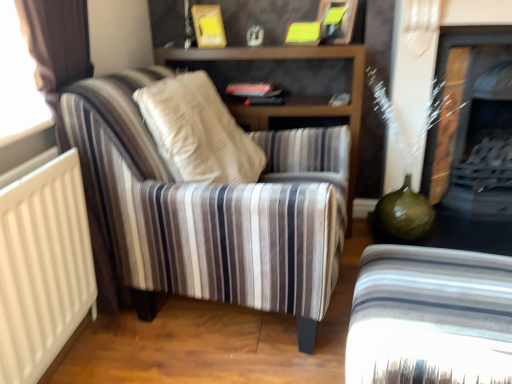
Describe the element at coordinates (211, 209) in the screenshot. I see `striped fabric armchair at left, which is the 2th chair from right to left` at that location.

Identify the location of striped fabric armchair at lower right, which is the 2th chair from left to right. The image size is (512, 384). (430, 317).

At what (x,y) coordinates should I click in order to perform the action: click on matte black fireplace at right. Please return your answer as a coordinate pair (x, y). Looking at the image, I should click on (475, 123).

Is striped fabric armchair at left, which is the 2th chair from right to left, to the left of matte black fireplace at right from the viewer's perspective?

Indeed, striped fabric armchair at left, which is the 2th chair from right to left, is positioned on the left side of matte black fireplace at right.

From the image's perspective, which one is positioned higher, striped fabric armchair at left, which is the 2th chair from right to left, or matte black fireplace at right?

matte black fireplace at right.

Which is correct: striped fabric armchair at left, which is the 2th chair from right to left, is inside matte black fireplace at right, or outside of it?

striped fabric armchair at left, which is the 2th chair from right to left, cannot be found inside matte black fireplace at right.

Can you confirm if matte black fireplace at right is thinner than striped fabric armchair at left, which ranks as the 1th chair in left-to-right order?

Yes.

From the picture: Does matte black fireplace at right lie behind striped fabric armchair at left, which ranks as the 1th chair in left-to-right order?

Yes, it is.

Is matte black fireplace at right inside or outside of striped fabric armchair at left, which is the 2th chair from right to left?

matte black fireplace at right cannot be found inside striped fabric armchair at left, which is the 2th chair from right to left.

How many degrees apart are the facing directions of matte black fireplace at right and striped fabric armchair at left, which is the 2th chair from right to left?

They differ by 80.3 degrees in their facing directions.

From a real-world perspective, which is physically below, matte black fireplace at right or striped fabric armchair at lower right, the 1th chair from the right?

striped fabric armchair at lower right, the 1th chair from the right, is physically lower.

You are a GUI agent. You are given a task and a screenshot of the screen. Output one action in this format:
    pyautogui.click(x=<x>, y=<y>)
    Task: Click on the chair that is the 2nd one when counting downward from the matte black fireplace at right (from the image's perspective)
    The image size is (512, 384).
    Given the screenshot: What is the action you would take?
    pyautogui.click(x=430, y=317)

Considering the points (490, 38) and (395, 284), which point is in front, point (490, 38) or point (395, 284)?

Point (395, 284)

Which object is further away from the camera, matte black fireplace at right or striped fabric armchair at lower right, the 1th chair from the right?

matte black fireplace at right is further from the camera.

Consider the image. Considering the sizes of objects striped fabric armchair at left, which is the 2th chair from right to left, and striped fabric armchair at lower right, the 1th chair from the right, in the image provided, who is shorter, striped fabric armchair at left, which is the 2th chair from right to left, or striped fabric armchair at lower right, the 1th chair from the right,?

striped fabric armchair at lower right, the 1th chair from the right, is shorter.

Are striped fabric armchair at left, which ranks as the 1th chair in left-to-right order, and striped fabric armchair at lower right, which is the 2th chair from left to right, beside each other?

No, striped fabric armchair at left, which ranks as the 1th chair in left-to-right order, is not with striped fabric armchair at lower right, which is the 2th chair from left to right.

From a real-world perspective, is striped fabric armchair at left, which ranks as the 1th chair in left-to-right order, under striped fabric armchair at lower right, which is the 2th chair from left to right?

No, from a real-world perspective, striped fabric armchair at left, which ranks as the 1th chair in left-to-right order, is not beneath striped fabric armchair at lower right, which is the 2th chair from left to right.

Which point is more distant from viewer, (327, 283) or (483, 268)?

The point (327, 283) is farther from the camera.

Is striped fabric armchair at lower right, the 1th chair from the right, oriented towards striped fabric armchair at left, which ranks as the 1th chair in left-to-right order?

No, striped fabric armchair at lower right, the 1th chair from the right, is not turned towards striped fabric armchair at left, which ranks as the 1th chair in left-to-right order.

Considering the sizes of striped fabric armchair at lower right, the 1th chair from the right, and striped fabric armchair at left, which is the 2th chair from right to left, in the image, is striped fabric armchair at lower right, the 1th chair from the right, wider or thinner than striped fabric armchair at left, which is the 2th chair from right to left,?

Considering their sizes, striped fabric armchair at lower right, the 1th chair from the right, looks slimmer than striped fabric armchair at left, which is the 2th chair from right to left.

From the image's perspective, is striped fabric armchair at lower right, the 1th chair from the right, located above or below striped fabric armchair at left, which ranks as the 1th chair in left-to-right order?

Clearly, from the image's perspective, striped fabric armchair at lower right, the 1th chair from the right, is below striped fabric armchair at left, which ranks as the 1th chair in left-to-right order.

Is striped fabric armchair at lower right, the 1th chair from the right, thinner than matte black fireplace at right?

No.

From the image's perspective, which one is positioned higher, striped fabric armchair at lower right, which is the 2th chair from left to right, or matte black fireplace at right?

From the image's view, matte black fireplace at right is above.

Consider the image. Is striped fabric armchair at lower right, the 1th chair from the right, bigger than matte black fireplace at right?

No, striped fabric armchair at lower right, the 1th chair from the right, is not bigger than matte black fireplace at right.

Which object is more forward, striped fabric armchair at lower right, the 1th chair from the right, or matte black fireplace at right?

striped fabric armchair at lower right, the 1th chair from the right, is more forward.

From the image's perspective, starting from the matte black fireplace at right, which chair is the 1st one below? Please provide its 2D coordinates.

[(211, 209)]

The height and width of the screenshot is (384, 512). What are the coordinates of `fireplace on the right of striped fabric armchair at left, which ranks as the 1th chair in left-to-right order` in the screenshot? It's located at (475, 123).

Which object lies further to the anchor point striped fabric armchair at left, which is the 2th chair from right to left, matte black fireplace at right or striped fabric armchair at lower right, the 1th chair from the right?

matte black fireplace at right lies further to striped fabric armchair at left, which is the 2th chair from right to left, than the other object.

Looking at the image, which one is located further to striped fabric armchair at lower right, the 1th chair from the right, matte black fireplace at right or striped fabric armchair at left, which ranks as the 1th chair in left-to-right order?

Based on the image, matte black fireplace at right appears to be further to striped fabric armchair at lower right, the 1th chair from the right.

From the image, which object appears to be nearer to striped fabric armchair at left, which is the 2th chair from right to left, striped fabric armchair at lower right, which is the 2th chair from left to right, or matte black fireplace at right?

striped fabric armchair at lower right, which is the 2th chair from left to right, is closer to striped fabric armchair at left, which is the 2th chair from right to left.

Which object lies further to the anchor point matte black fireplace at right, striped fabric armchair at lower right, the 1th chair from the right, or striped fabric armchair at left, which ranks as the 1th chair in left-to-right order?

striped fabric armchair at left, which ranks as the 1th chair in left-to-right order.

Based on their spatial positions, is striped fabric armchair at left, which is the 2th chair from right to left, or striped fabric armchair at lower right, the 1th chair from the right, closer to matte black fireplace at right?

Among the two, striped fabric armchair at lower right, the 1th chair from the right, is located nearer to matte black fireplace at right.

Consider the image. From the image, which object appears to be farther from striped fabric armchair at lower right, the 1th chair from the right, striped fabric armchair at left, which is the 2th chair from right to left, or matte black fireplace at right?

The object further to striped fabric armchair at lower right, the 1th chair from the right, is matte black fireplace at right.

Locate an element on the screen. The height and width of the screenshot is (384, 512). chair situated between striped fabric armchair at left, which is the 2th chair from right to left, and matte black fireplace at right from left to right is located at coordinates (430, 317).